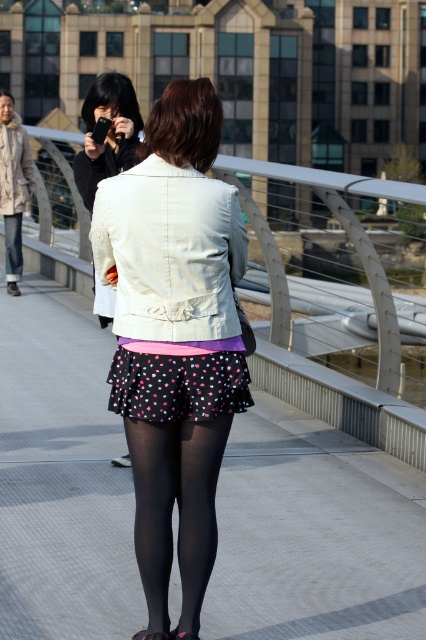
You are standing on the pedestrian bridge and see two points marked in the image. Which point is closer to you, point (100, 188) or point (178, 538)?

Point (100, 188) is closer to the viewer than point (178, 538).

You are a photographer trying to capture the woman in the scene. Since the polka dot skirt at center and black tights at center are both visible, which one is covering the other?

The polka dot skirt at center is positioned over black tights at center, so the skirt is covering the tights.